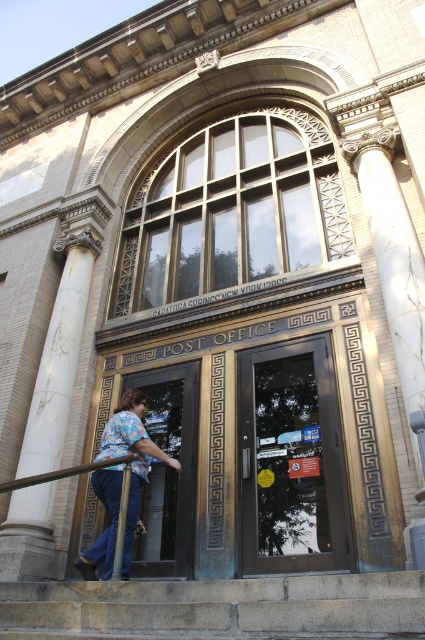
Consider the image. You are a delivery person carrying a large package and need to ascend the gray stone steps at lower center while avoiding the blue jeans at lower left. Which path should you choose to ensure you can carry the package comfortably?

The gray stone steps at lower center might be wider than blue jeans at lower left, so choosing the path on the gray stone steps at lower center would provide more space to carry the package comfortably.

You are a delivery person standing at the entrance of the post office. You need to hand over a package to the receptionist. The shiny dark glass door at center and blue jeans at lower left are in your view. Which object is on the right side from your perspective?

The shiny dark glass door at center is positioned on the right side of blue jeans at lower left, so it is on the right side from your perspective.

You are standing at the entrance of the historic post office building. You see a shiny dark glass door at center and blue jeans at lower left. Which object is higher in the scene?

The shiny dark glass door at center is above blue jeans at lower left, so the shiny dark glass door at center is higher in the scene.